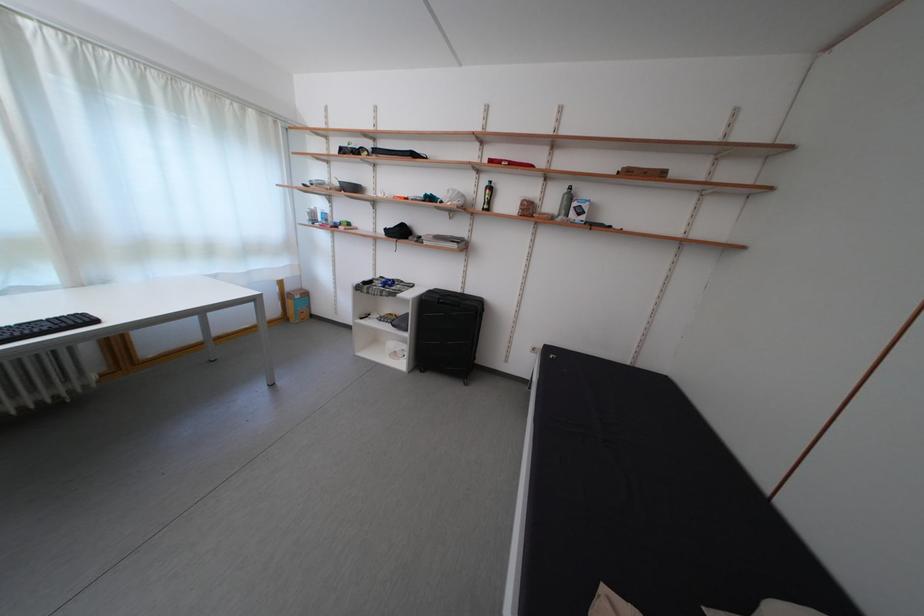
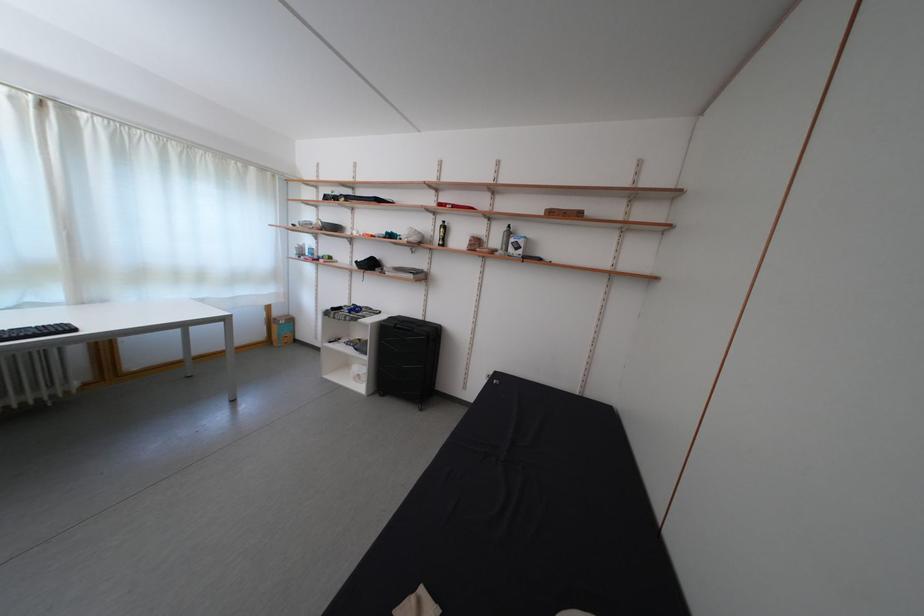
The point at (298, 294) is marked in the first image. Where is the corresponding point in the second image?

(285, 320)